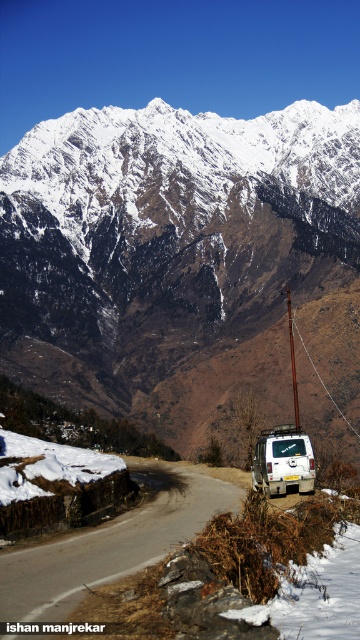
You are a hiker planning to take a photo of the snowy granite mountain range at upper center and the brown wooden pole at center. From your current position, which object would appear to be on the left side when both are in the frame?

The snowy granite mountain range at upper center is positioned on the left side of the brown wooden pole at center, so it would appear on the left when both are in the frame.

You are a hiker planning to take a photo of the snowy granite mountain range at upper center from the position of the white matte van at lower right. Considering the distance between them, would you need a telephoto lens to capture the entire mountain range in your shot?

The distance between the snowy granite mountain range at upper center and the white matte van at lower right is 190.81 meters. To capture the entire mountain range from this distance, a telephoto lens would be necessary to compress the scene and ensure the mountains fill the frame effectively.